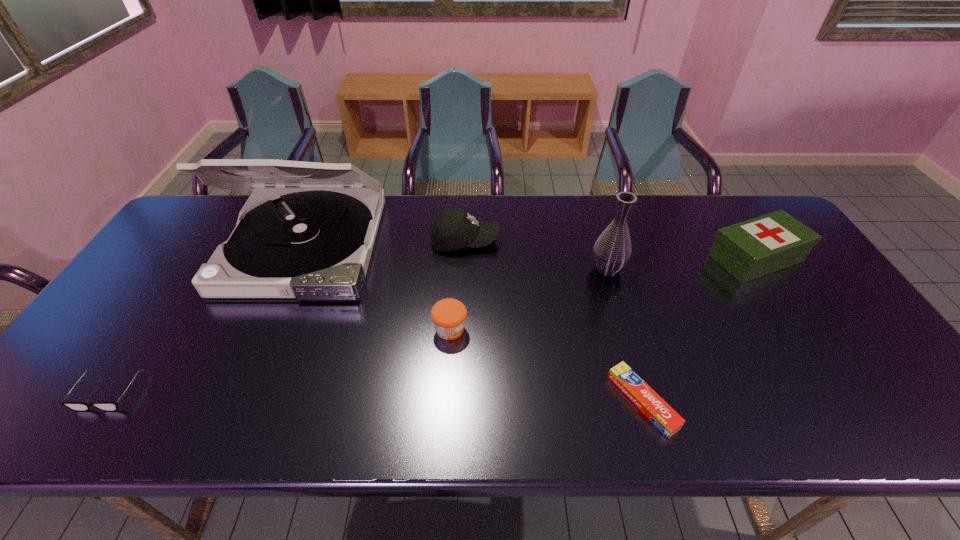
Where is `vacant space located on the back of the sixth shortest object`? vacant space located on the back of the sixth shortest object is located at coordinates 599,242.

Identify the location of free region located on the front-facing side of the baseball cap. (547, 240).

Image resolution: width=960 pixels, height=540 pixels. Identify the location of free space located on the back of the first-aid kit. (721, 206).

Locate an element on the screen. vacant space located on the front label of the fifth farthest object is located at coordinates (586, 329).

Locate an element on the screen. This screenshot has height=540, width=960. vacant point located 0.050m on the front-facing side of the leftmost object is located at coordinates (81, 434).

In order to click on vacant space located 0.070m on the back of the toothpaste in this screenshot , I will do `click(626, 345)`.

Find the location of `CD player located in the far edge section of the desktop`. CD player located in the far edge section of the desktop is located at coordinates (307, 232).

The height and width of the screenshot is (540, 960). What are the coordinates of `baseball cap present at the far edge` in the screenshot? It's located at (452, 229).

Locate an element on the screen. This screenshot has width=960, height=540. the first-aid kit present at the far edge is located at coordinates (754, 248).

Find the location of a particular element. Image resolution: width=960 pixels, height=540 pixels. spectacles that is at the near edge is located at coordinates (75, 406).